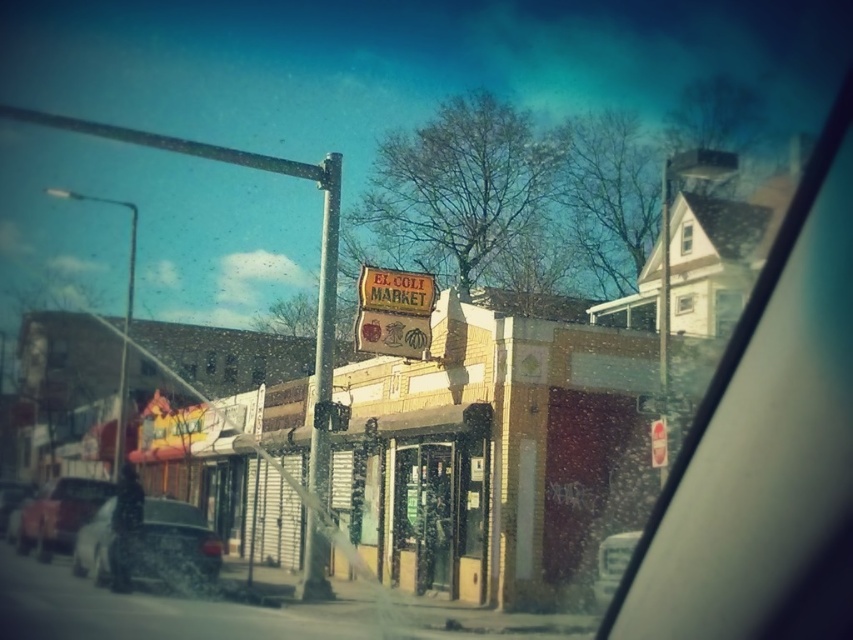
Looking at this image, is metallic pole at center to the right of white plastic air vent at lower right from the viewer's perspective?

Incorrect, metallic pole at center is not on the right side of white plastic air vent at lower right.

Between point (318, 355) and point (616, 545), which one is positioned behind?

Positioned behind is point (318, 355).

Who is more distant from viewer, (337,152) or (628,561)?

Point (337,152)

Locate an element on the screen. The width and height of the screenshot is (853, 640). metallic pole at center is located at coordinates (323, 326).

Which of these two, transparent glass windshield at upper right or wooden signboard at center, stands taller?

transparent glass windshield at upper right

This screenshot has height=640, width=853. Describe the element at coordinates (766, 445) in the screenshot. I see `transparent glass windshield at upper right` at that location.

Where is `transparent glass windshield at upper right`? This screenshot has width=853, height=640. transparent glass windshield at upper right is located at coordinates (766, 445).

Does wooden signboard at center have a lesser height compared to metallic silver car at lower left?

Incorrect, wooden signboard at center's height does not fall short of metallic silver car at lower left's.

Which is more to the right, wooden signboard at center or metallic silver car at lower left?

Positioned to the right is wooden signboard at center.

Is point (373, 300) positioned in front of point (102, 486)?

Yes, it is in front of point (102, 486).

Find the location of `wooden signboard at center`. wooden signboard at center is located at coordinates (393, 312).